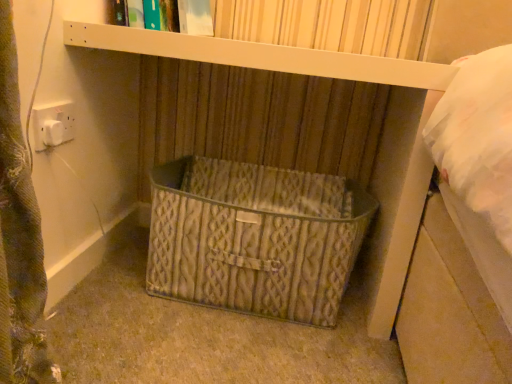
The width and height of the screenshot is (512, 384). What are the coordinates of `free space in front of rustic metal basket at center` in the screenshot? It's located at (220, 350).